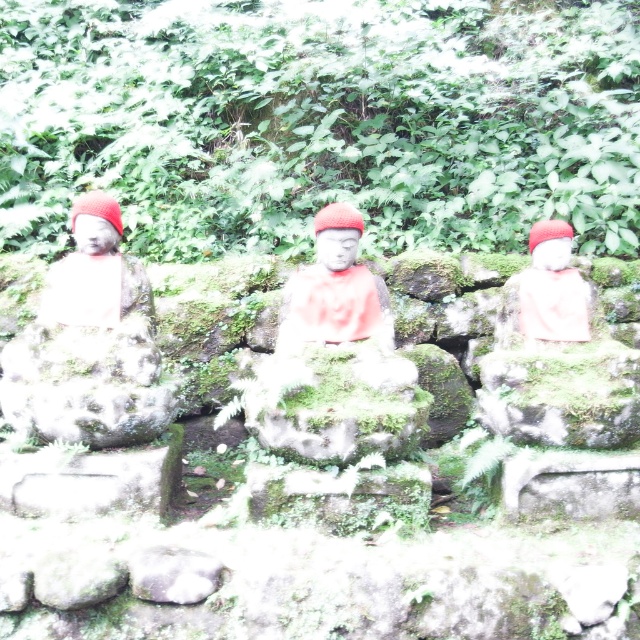
You are a tour guide leading a group through a temple garden. You want to ensure visitors can comfortably walk between the white stone monk at left and the matte white statue at right without feeling cramped. The average width of a person is 2 feet. Can visitors walk between them comfortably?

The distance between the white stone monk at left and the matte white statue at right is 3.70 feet. Since the average width of a person is 2 feet, visitors can comfortably walk between them as there is enough space.

You are an art conservator assessing the statues in the garden. You notice that the matte stone statue at left and the matte red statue at center need to be moved to a storage facility. The storage has a weight limit of 500 kg per shelf. Given that the larger statue weighs 600 kg and the smaller one weighs 300 kg, can both statues be placed on the same shelf without exceeding the weight limit?

The matte stone statue at left has a larger size compared to matte red statue at center. Since the larger statue weighs 600 kg and the smaller one weighs 300 kg, placing both on the same shelf would total 900 kg, exceeding the 500 kg limit. Therefore, they cannot be placed together.